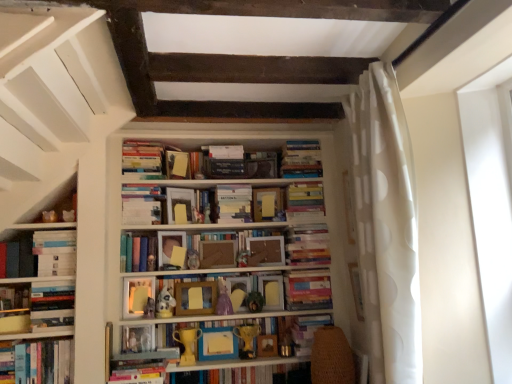
Question: Considering the positions of white matte bookshelf at center and matte plastic toy at center, the 5th toy in the left-to-right sequence, in the image, is white matte bookshelf at center taller or shorter than matte plastic toy at center, the 5th toy in the left-to-right sequence,?

Choices:
 (A) short
 (B) tall

Answer: (B)

Question: Considering the relative positions of white matte bookshelf at center and matte plastic toy at center, the 5th toy in the left-to-right sequence, in the image provided, is white matte bookshelf at center to the left or to the right of matte plastic toy at center, the 5th toy in the left-to-right sequence,?

Choices:
 (A) right
 (B) left

Answer: (B)

Question: Estimate the real-world distances between objects in this image. Which object is farther from the hardcover books at left, placed as the 3th book when sorted from top to bottom?

Choices:
 (A) hardcover book at center, which is the 3th paperback book in top-to-bottom order
 (B) hardcover books at center, the 1th book from the top
 (C) hardcover book at center, the 4th book from the top
 (D) white matte plush toy at center, marked as the 6th toy in a right-to-left arrangement
 (E) matte yellow paper at center, which is the first paperback book in top-to-bottom order

Answer: (B)

Question: Based on their relative distances, which object is farther from the matte paper at center, placed as the 9th paperback book when sorted from bottom to top?

Choices:
 (A) hardcover book at center, marked as the second paperback book in a top-to-bottom arrangement
 (B) white matte bookshelf at center
 (C) hardcover book at center, placed as the 6th book when sorted from top to bottom
 (D) matte yellow paperback book at center, placed as the 12th paperback book when sorted from top to bottom
 (E) white dotted fabric at right

Answer: (E)